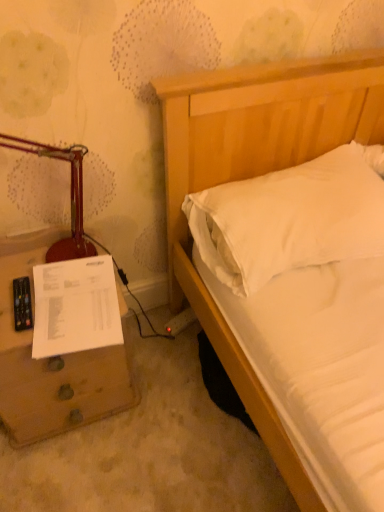
Question: From the image's perspective, is white soft pillow at upper right beneath white paper at lower left?

Choices:
 (A) no
 (B) yes

Answer: (A)

Question: From the image's perspective, does white soft pillow at upper right appear higher than white paper at lower left?

Choices:
 (A) no
 (B) yes

Answer: (B)

Question: Can we say white soft pillow at upper right lies outside white paper at lower left?

Choices:
 (A) no
 (B) yes

Answer: (B)

Question: Is white soft pillow at upper right wider than white paper at lower left?

Choices:
 (A) no
 (B) yes

Answer: (B)

Question: Considering the relative positions of white soft pillow at upper right and white paper at lower left in the image provided, is white soft pillow at upper right in front of white paper at lower left?

Choices:
 (A) yes
 (B) no

Answer: (A)

Question: Is matte red table lamp at left taller or shorter than brown wooden nightstand at lower left?

Choices:
 (A) tall
 (B) short

Answer: (B)

Question: From a real-world perspective, is matte red table lamp at left above or below brown wooden nightstand at lower left?

Choices:
 (A) below
 (B) above

Answer: (B)

Question: In terms of size, does matte red table lamp at left appear bigger or smaller than brown wooden nightstand at lower left?

Choices:
 (A) big
 (B) small

Answer: (B)

Question: Would you say matte red table lamp at left is to the left or to the right of brown wooden nightstand at lower left in the picture?

Choices:
 (A) right
 (B) left

Answer: (B)

Question: Which is correct: white paper at lower left is inside white soft pillow at upper right, or outside of it?

Choices:
 (A) outside
 (B) inside

Answer: (A)

Question: Visually, is white paper at lower left positioned to the left or to the right of white soft pillow at upper right?

Choices:
 (A) right
 (B) left

Answer: (B)

Question: Looking at their shapes, would you say white paper at lower left is wider or thinner than white soft pillow at upper right?

Choices:
 (A) wide
 (B) thin

Answer: (B)

Question: From a real-world perspective, relative to white soft pillow at upper right, is white paper at lower left vertically above or below?

Choices:
 (A) above
 (B) below

Answer: (B)

Question: From a real-world perspective, relative to brown wooden nightstand at lower left, is white soft pillow at upper right vertically above or below?

Choices:
 (A) above
 (B) below

Answer: (A)

Question: Does point (372, 168) appear closer or farther from the camera than point (11, 332)?

Choices:
 (A) closer
 (B) farther

Answer: (B)